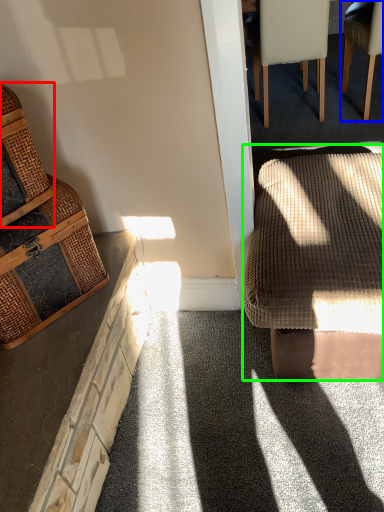
Question: Estimate the real-world distances between objects in this image. Which object is closer to basket (highlighted by a red box), chair (highlighted by a blue box) or rocking chair (highlighted by a green box)?

Choices:
 (A) chair
 (B) rocking chair

Answer: (B)